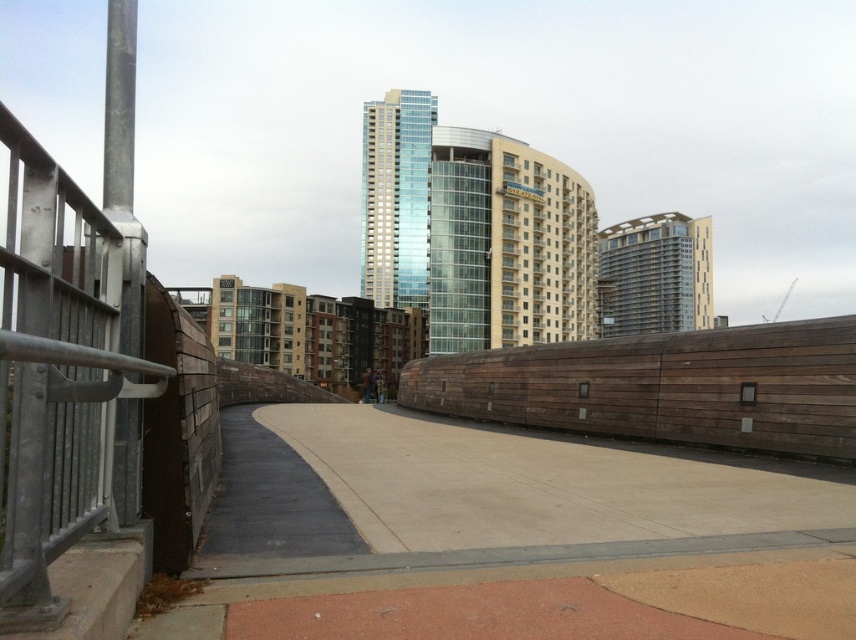
Question: Can you confirm if silver metallic railing at left is bigger than brown wooden fence at center?

Choices:
 (A) yes
 (B) no

Answer: (B)

Question: Does silver metallic railing at left have a larger size compared to brown wooden fence at center?

Choices:
 (A) yes
 (B) no

Answer: (B)

Question: Which point is closer to the camera taking this photo?

Choices:
 (A) (788, 333)
 (B) (6, 424)

Answer: (B)

Question: Can you confirm if silver metallic railing at left is positioned to the left of brown wooden fence at center?

Choices:
 (A) yes
 (B) no

Answer: (A)